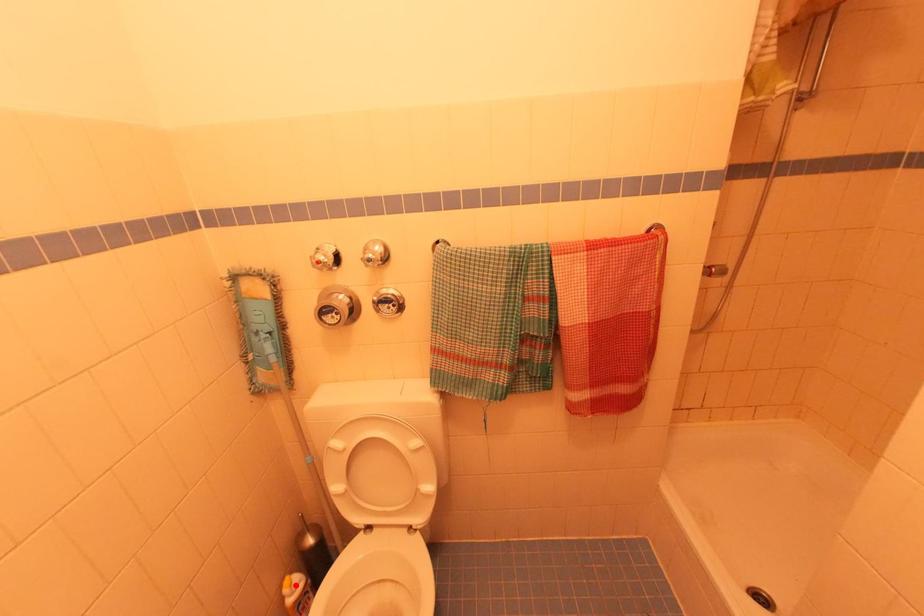
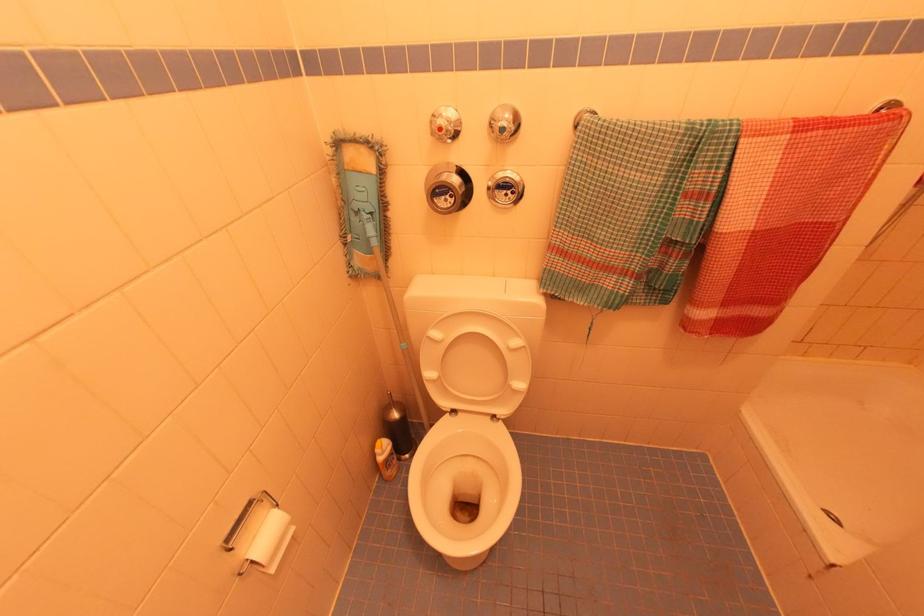
Question: I am providing you with two images of the same scene from different viewpoints. Image1 has a red point marked. In image2, the corresponding 3D location appears at what relative position? Reply with the corresponding letter.

Choices:
 (A) Closer
 (B) Farther

Answer: (A)